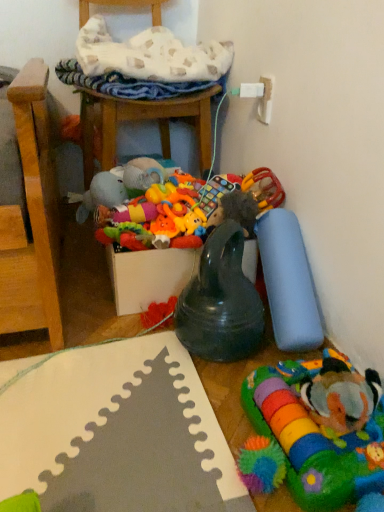
Question: Does rubberized plastic rattle at right, placed as the third toy when sorted from left to right, have a larger size compared to wooden chair at upper center?

Choices:
 (A) no
 (B) yes

Answer: (A)

Question: Is rubberized plastic rattle at right, placed as the third toy when sorted from left to right, positioned before wooden chair at upper center?

Choices:
 (A) no
 (B) yes

Answer: (B)

Question: Is rubberized plastic rattle at right, placed as the third toy when sorted from left to right, facing towards wooden chair at upper center?

Choices:
 (A) yes
 (B) no

Answer: (B)

Question: Considering the relative sizes of rubberized plastic rattle at right, placed as the third toy when sorted from left to right, and wooden chair at upper center in the image provided, is rubberized plastic rattle at right, placed as the third toy when sorted from left to right, thinner than wooden chair at upper center?

Choices:
 (A) no
 (B) yes

Answer: (B)

Question: Can you confirm if rubberized plastic rattle at right, placed as the third toy when sorted from left to right, is positioned to the right of wooden chair at upper center?

Choices:
 (A) yes
 (B) no

Answer: (A)

Question: From their relative heights in the image, would you say soft plush toy at center, placed as the fifth toy when sorted from right to left, is taller or shorter than rubberized black teething ring at center, the second toy from the left?

Choices:
 (A) tall
 (B) short

Answer: (B)

Question: In the image, is soft plush toy at center, placed as the fifth toy when sorted from right to left, on the left side or the right side of rubberized black teething ring at center, the second toy from the left?

Choices:
 (A) left
 (B) right

Answer: (A)

Question: From the image's perspective, is soft plush toy at center, acting as the 1th toy starting from the left, positioned above or below rubberized black teething ring at center, the second toy from the left?

Choices:
 (A) below
 (B) above

Answer: (B)

Question: Looking at their shapes, would you say soft plush toy at center, acting as the 1th toy starting from the left, is wider or thinner than rubberized black teething ring at center, the second toy from the left?

Choices:
 (A) thin
 (B) wide

Answer: (B)

Question: Would you say wooden chair at upper center is to the left or to the right of multicolored plush toy at lower right, which appears as the second toy when viewed from the right, in the picture?

Choices:
 (A) right
 (B) left

Answer: (B)

Question: From their relative heights in the image, would you say wooden chair at upper center is taller or shorter than multicolored plush toy at lower right, marked as the 4th toy in a left-to-right arrangement?

Choices:
 (A) tall
 (B) short

Answer: (A)

Question: Choose the correct answer: Is wooden chair at upper center inside multicolored plush toy at lower right, marked as the 4th toy in a left-to-right arrangement, or outside it?

Choices:
 (A) inside
 (B) outside

Answer: (B)

Question: Considering the positions of wooden chair at upper center and multicolored plush toy at lower right, marked as the 4th toy in a left-to-right arrangement, in the image, is wooden chair at upper center bigger or smaller than multicolored plush toy at lower right, marked as the 4th toy in a left-to-right arrangement,?

Choices:
 (A) big
 (B) small

Answer: (A)

Question: From the image's perspective, is soft plush toy at center, placed as the fifth toy when sorted from right to left, above or below rubberized plastic rattle at right, placed as the third toy when sorted from left to right?

Choices:
 (A) below
 (B) above

Answer: (B)

Question: In terms of height, does soft plush toy at center, placed as the fifth toy when sorted from right to left, look taller or shorter compared to rubberized plastic rattle at right, placed as the third toy when sorted from left to right?

Choices:
 (A) tall
 (B) short

Answer: (A)